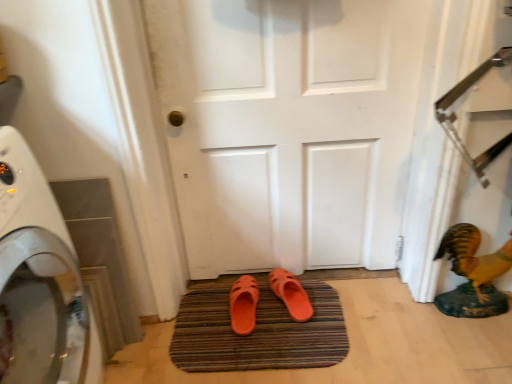
The width and height of the screenshot is (512, 384). I want to click on free point above orange rubber bath mat at center (from a real-world perspective), so point(254,324).